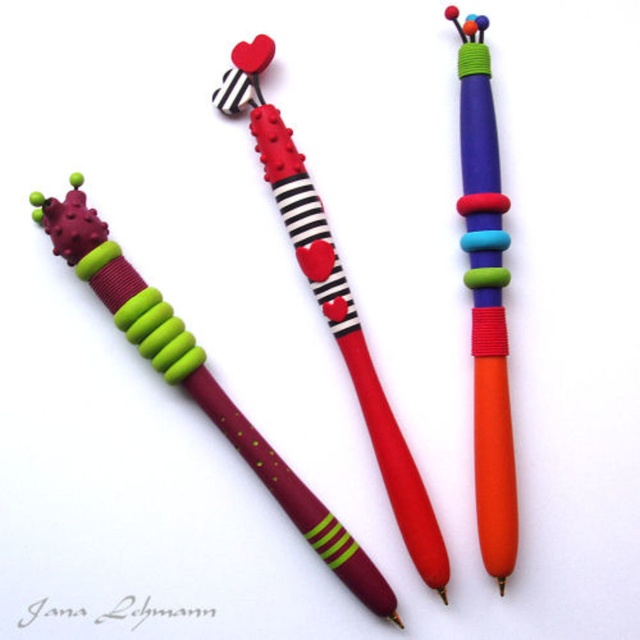
Which is behind, point (198, 404) or point (426, 554)?

The point (198, 404) is more distant.

Which of these two, burgundy matte pen at center or matte striped pen at center, stands shorter?

With less height is burgundy matte pen at center.

Is point (342, 556) more distant than point (412, 528)?

That is False.

The height and width of the screenshot is (640, 640). What are the coordinates of `burgundy matte pen at center` in the screenshot? It's located at pos(198,381).

Can you confirm if matte striped pen at center is taller than matte plastic pen at center?

In fact, matte striped pen at center may be shorter than matte plastic pen at center.

Image resolution: width=640 pixels, height=640 pixels. What are the coordinates of `matte striped pen at center` in the screenshot? It's located at (333, 301).

This screenshot has width=640, height=640. Identify the location of matte striped pen at center. (333, 301).

Is burgundy matte pen at center to the left of matte plastic pen at center from the viewer's perspective?

Indeed, burgundy matte pen at center is positioned on the left side of matte plastic pen at center.

Who is more forward, (84,227) or (465,74)?

Point (84,227) is more forward.

The image size is (640, 640). In order to click on burgundy matte pen at center in this screenshot , I will do `click(198, 381)`.